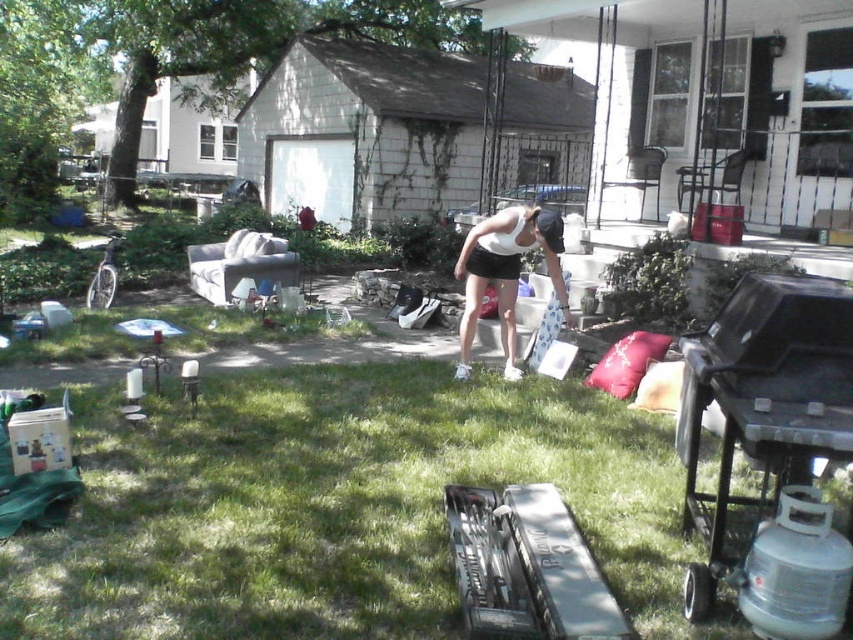
Question: Does black matte barbecue grill at lower right have a greater width compared to white matte tank top at center?

Choices:
 (A) no
 (B) yes

Answer: (A)

Question: In this image, where is black matte barbecue grill at lower right located relative to white matte tank top at center?

Choices:
 (A) right
 (B) left

Answer: (A)

Question: Among these objects, which one is nearest to the camera?

Choices:
 (A) white matte tank top at center
 (B) black matte barbecue grill at lower right

Answer: (B)

Question: Which point is farther to the camera?

Choices:
 (A) (720, 385)
 (B) (509, 321)

Answer: (B)

Question: Where is black matte barbecue grill at lower right located in relation to white matte tank top at center in the image?

Choices:
 (A) below
 (B) above

Answer: (A)